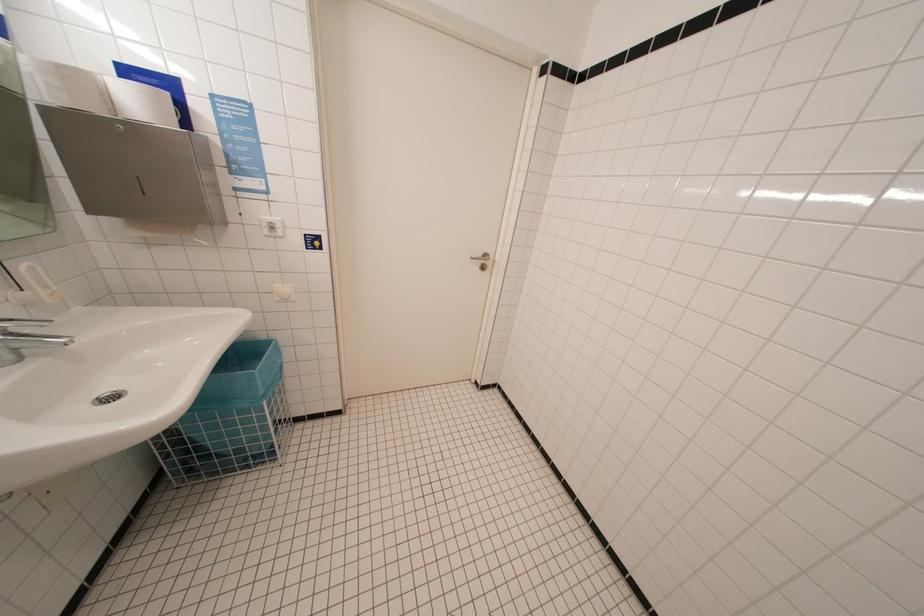
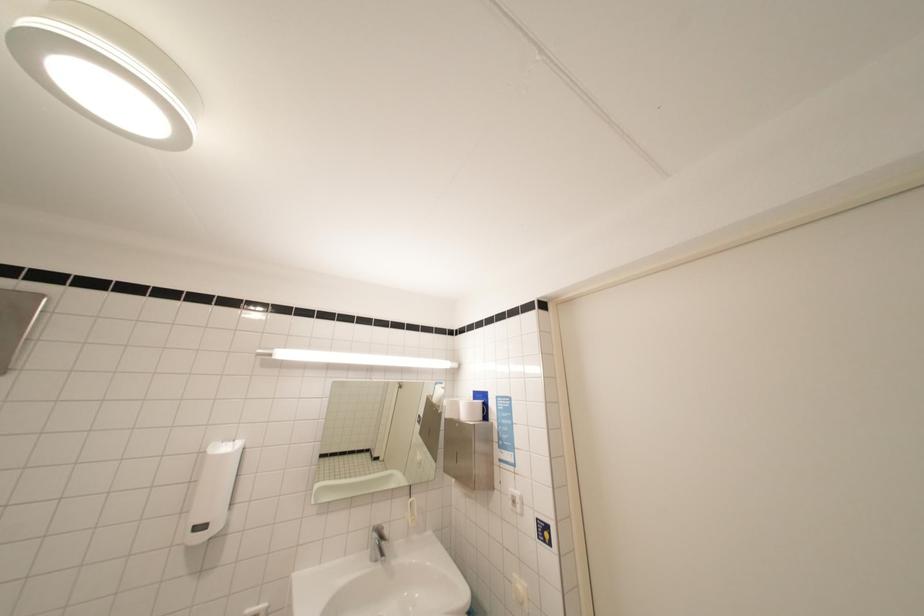
The images are taken continuously from a first-person perspective. In which direction is your viewpoint rotating?

The camera's rotation is toward left-up.